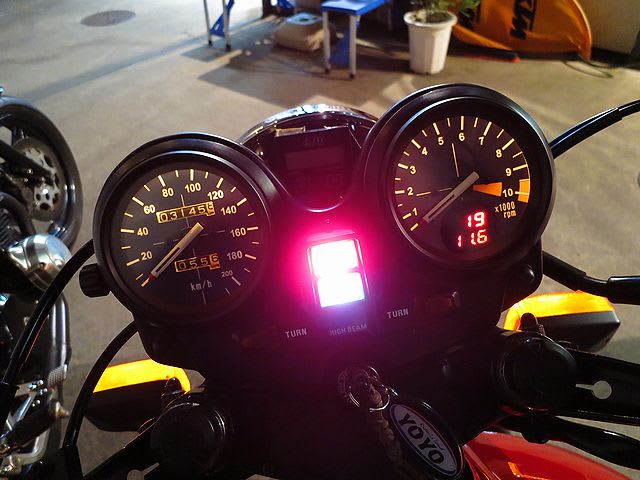
Where is `lights`? The height and width of the screenshot is (480, 640). lights is located at coordinates (125, 396), (576, 320).